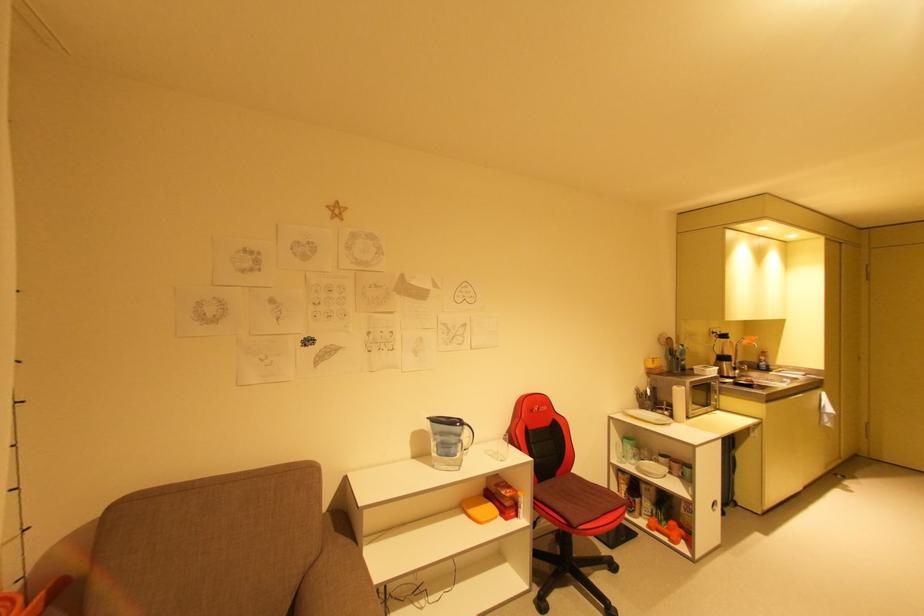
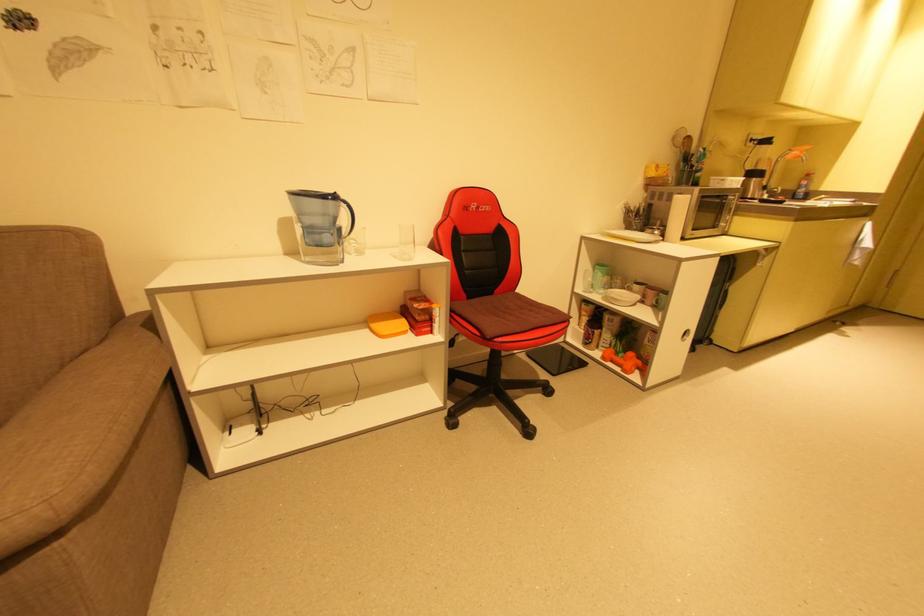
Locate, in the second image, the point that corresponds to point 756,341 in the first image.

(805, 152)